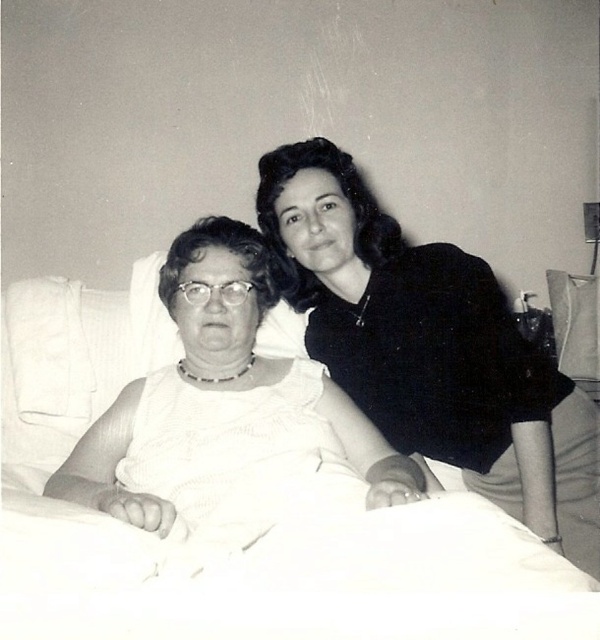
Is white fabric hospital bed at center to the left of white fabric at upper right from the viewer's perspective?

Yes, white fabric hospital bed at center is to the left of white fabric at upper right.

Can you confirm if white fabric hospital bed at center is smaller than white fabric at upper right?

Actually, white fabric hospital bed at center might be larger than white fabric at upper right.

Which is behind, point (534, 579) or point (416, 452)?

Positioned behind is point (416, 452).

This screenshot has height=640, width=600. Identify the location of white fabric hospital bed at center. (244, 552).

Which is below, white fabric at upper right or white fabric at center?

white fabric at center is lower down.

Between point (271, 212) and point (319, 381), which one is positioned in front?

Point (319, 381)

Find the location of `white fabric at upper right`. white fabric at upper right is located at coordinates (430, 348).

Does white fabric hospital bed at center have a greater height compared to white fabric at center?

No, white fabric hospital bed at center is not taller than white fabric at center.

Between white fabric hospital bed at center and white fabric at center, which one has less height?

white fabric hospital bed at center is shorter.

Is point (459, 536) closer to camera compared to point (82, 444)?

That is True.

You are a GUI agent. You are given a task and a screenshot of the screen. Output one action in this format:
    pyautogui.click(x=<x>, y=<y>)
    Task: Click on the white fabric hospital bed at center
    
    Given the screenshot: What is the action you would take?
    pyautogui.click(x=244, y=552)